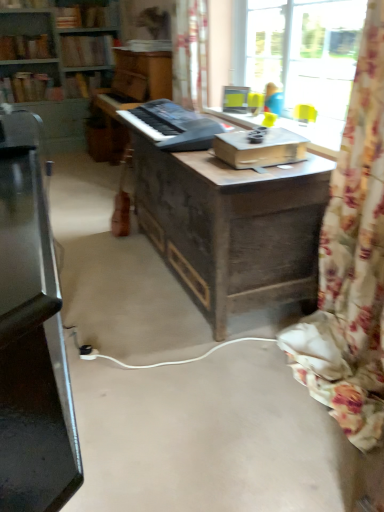
Find the location of a particular element. The width and height of the screenshot is (384, 512). free space to the left of floral fabric curtain at right, acting as the 1th curtain starting from the bottom is located at coordinates (233, 393).